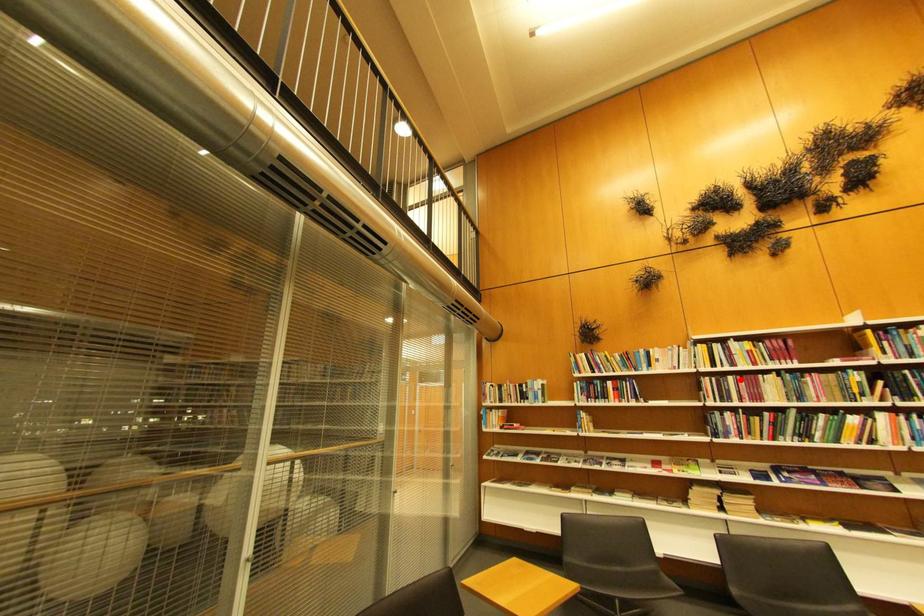
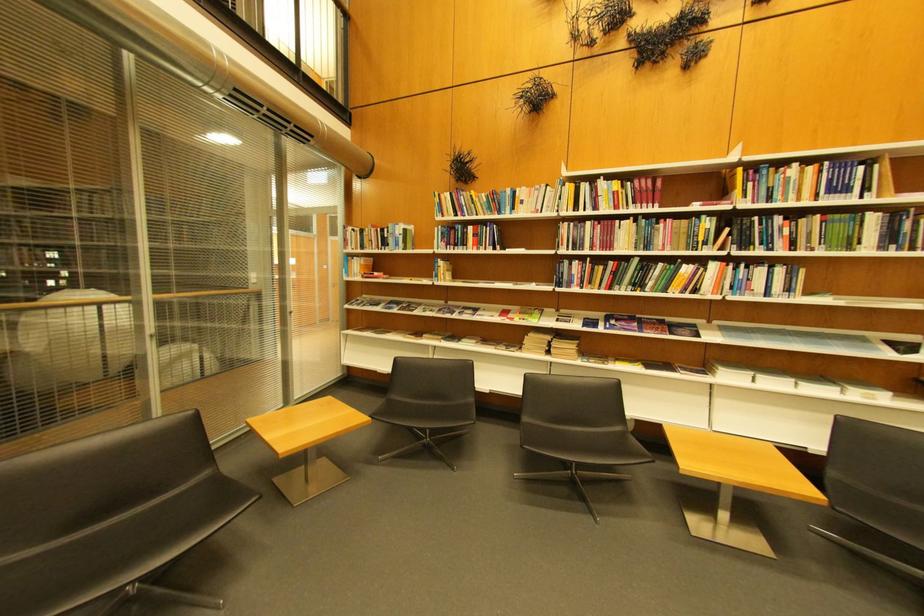
In the second image, find the point that corresponds to the highlighted location in the first image.

(600, 225)